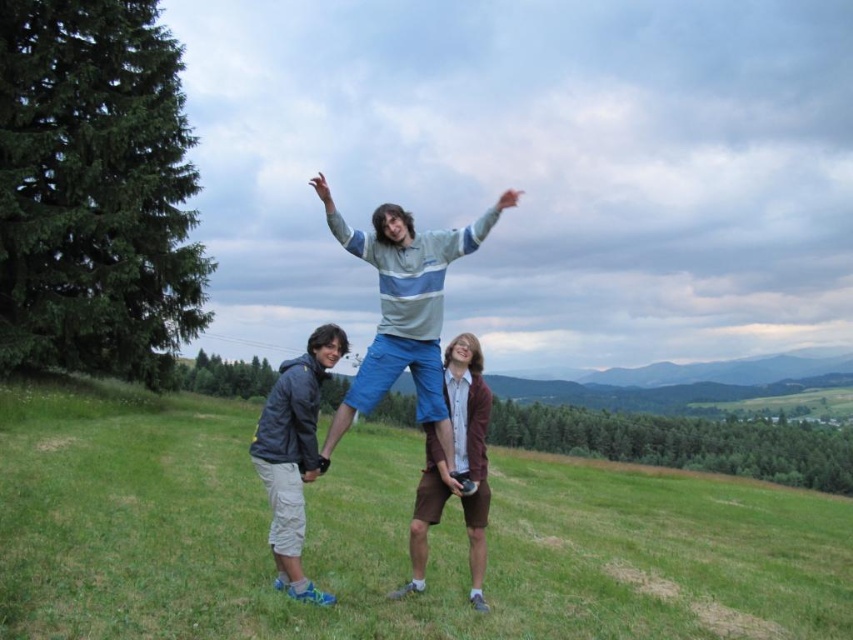
Question: Can you confirm if striped cotton shirt at center is thinner than gray fabric jacket at lower left?

Choices:
 (A) yes
 (B) no

Answer: (B)

Question: Is striped cotton shirt at center thinner than gray fabric jacket at lower left?

Choices:
 (A) no
 (B) yes

Answer: (A)

Question: Can you confirm if green grassy field at center is wider than striped cotton shirt at center?

Choices:
 (A) yes
 (B) no

Answer: (A)

Question: Among these points, which one is nearest to the camera?

Choices:
 (A) pos(293,412)
 (B) pos(225,508)

Answer: (A)

Question: Which of the following is the closest to the observer?

Choices:
 (A) (480, 216)
 (B) (534, 516)

Answer: (A)

Question: Which object is positioned closest to the gray fabric jacket at lower left?

Choices:
 (A) striped cotton shirt at center
 (B) green grassy field at center

Answer: (A)